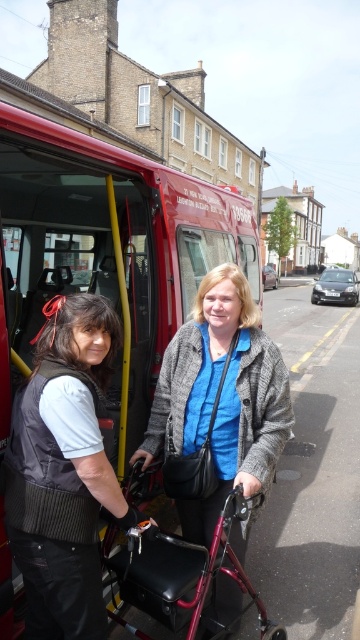
Between point (34, 337) and point (240, 435), which one is positioned behind?

The point (34, 337) is more distant.

Which of these two, black leather vest at left or matte gray coat at center, stands shorter?

Standing shorter between the two is black leather vest at left.

The width and height of the screenshot is (360, 640). Find the location of `black leather vest at left`. black leather vest at left is located at coordinates (64, 470).

Locate an element on the screen. black leather vest at left is located at coordinates (64, 470).

Can you confirm if red matte bus at center is smaller than metallic burgundy walker at center?

Indeed, red matte bus at center has a smaller size compared to metallic burgundy walker at center.

The image size is (360, 640). Describe the element at coordinates (106, 252) in the screenshot. I see `red matte bus at center` at that location.

Where is `red matte bus at center`? The height and width of the screenshot is (640, 360). red matte bus at center is located at coordinates (106, 252).

Is point (159, 388) positioned before point (119, 618)?

No, (159, 388) is behind (119, 618).

Does point (231, 376) lie behind point (147, 596)?

Yes.

Image resolution: width=360 pixels, height=640 pixels. In order to click on matte gray coat at center in this screenshot , I will do `click(221, 397)`.